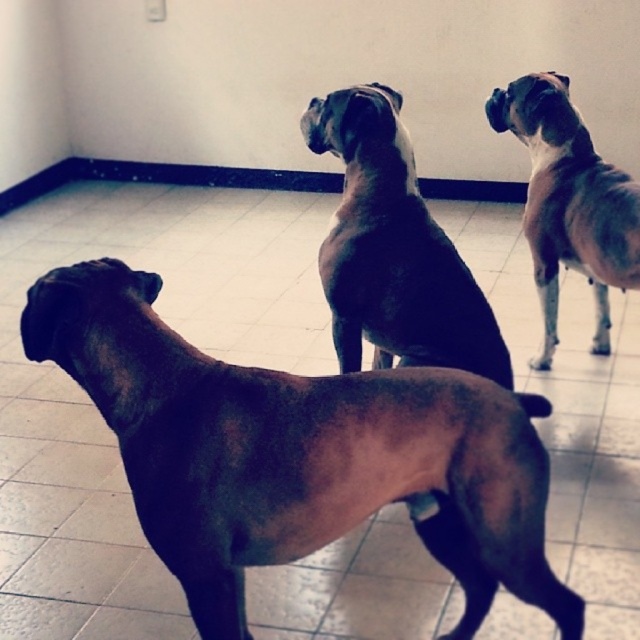
Question: Which object is closer to the camera taking this photo?

Choices:
 (A) brown fur dog at center
 (B) brown matte dog at center

Answer: (B)

Question: Is brown matte dog at center wider than brown fur dog at center?

Choices:
 (A) yes
 (B) no

Answer: (A)

Question: Which object is positioned farthest from the brown fur dog at center?

Choices:
 (A) brown smooth coat at upper right
 (B) brown matte dog at center

Answer: (B)

Question: Based on their relative distances, which object is nearer to the brown matte dog at center?

Choices:
 (A) brown smooth coat at upper right
 (B) brown fur dog at center

Answer: (B)

Question: Is brown matte dog at center to the left of brown smooth coat at upper right from the viewer's perspective?

Choices:
 (A) no
 (B) yes

Answer: (B)

Question: Does brown fur dog at center appear on the left side of brown smooth coat at upper right?

Choices:
 (A) yes
 (B) no

Answer: (A)